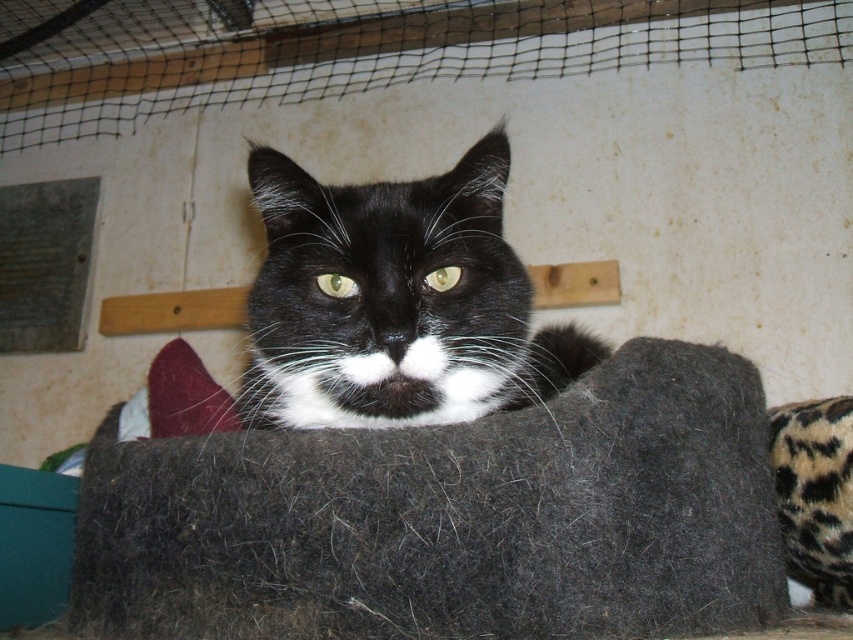
Does fuzzy charcoal cat bed at center have a greater width compared to black fur cat at center?

Indeed, fuzzy charcoal cat bed at center has a greater width compared to black fur cat at center.

What do you see at coordinates (444, 515) in the screenshot? I see `fuzzy charcoal cat bed at center` at bounding box center [444, 515].

Which is behind, point (776, 589) or point (338, 316)?

The point (776, 589) is behind.

Where is `fuzzy charcoal cat bed at center`? The height and width of the screenshot is (640, 853). fuzzy charcoal cat bed at center is located at coordinates (444, 515).